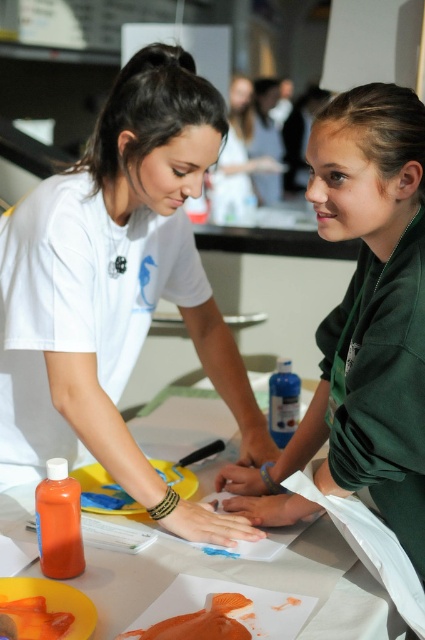
Question: Observing the image, what is the correct spatial positioning of matte white shirt at center in reference to orange matte fish at center?

Choices:
 (A) right
 (B) left

Answer: (B)

Question: Is matte white shirt at center to the left of orange matte food at lower left from the viewer's perspective?

Choices:
 (A) no
 (B) yes

Answer: (A)

Question: Is matte white shirt at center wider than orange matte fish at center?

Choices:
 (A) no
 (B) yes

Answer: (B)

Question: Which object appears farthest from the camera in this image?

Choices:
 (A) orange matte fish at center
 (B) matte white shirt at center
 (C) white paper at center
 (D) green matte shirt at center

Answer: (B)

Question: Which object is farther from the camera taking this photo?

Choices:
 (A) orange matte fish at center
 (B) matte white shirt at center

Answer: (B)

Question: Among these objects, which one is farthest from the camera?

Choices:
 (A) white paper at center
 (B) orange matte fish at center

Answer: (A)